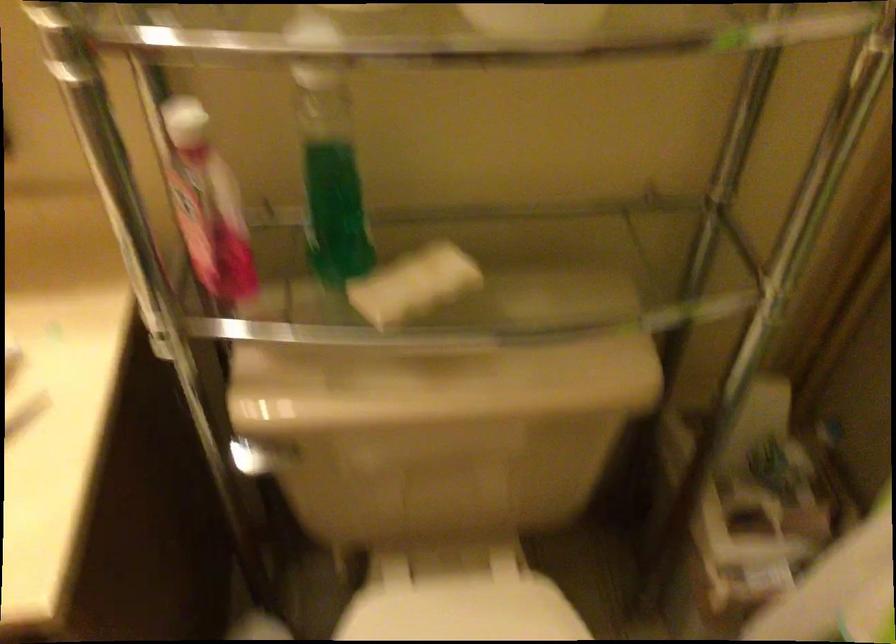
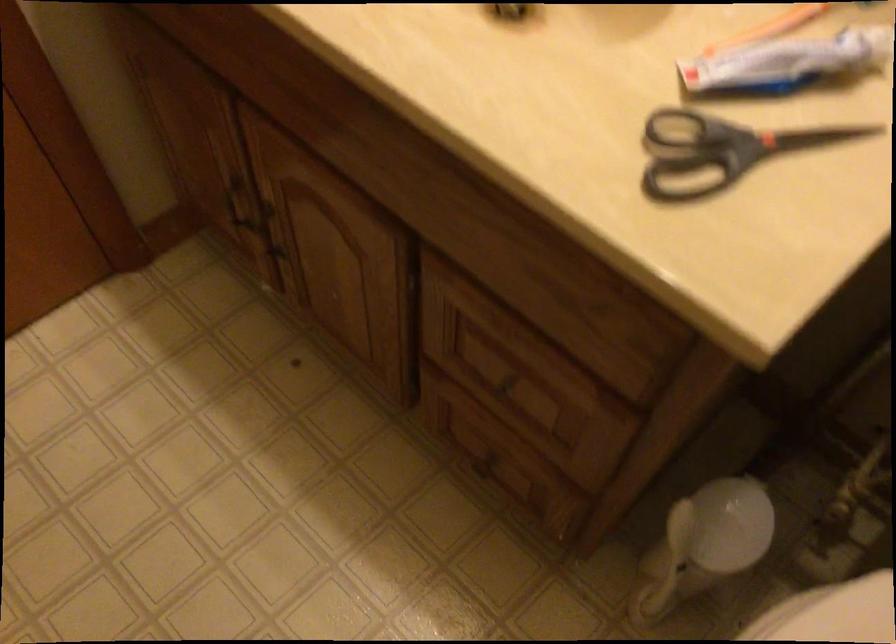
First-person continuous shooting, in which direction is the camera rotating?

The camera rotated toward left-down.